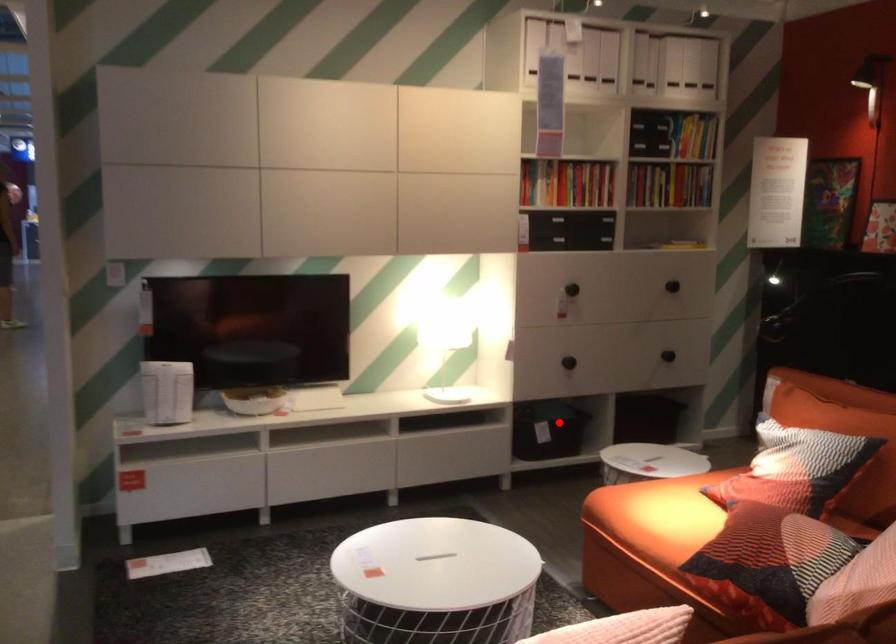
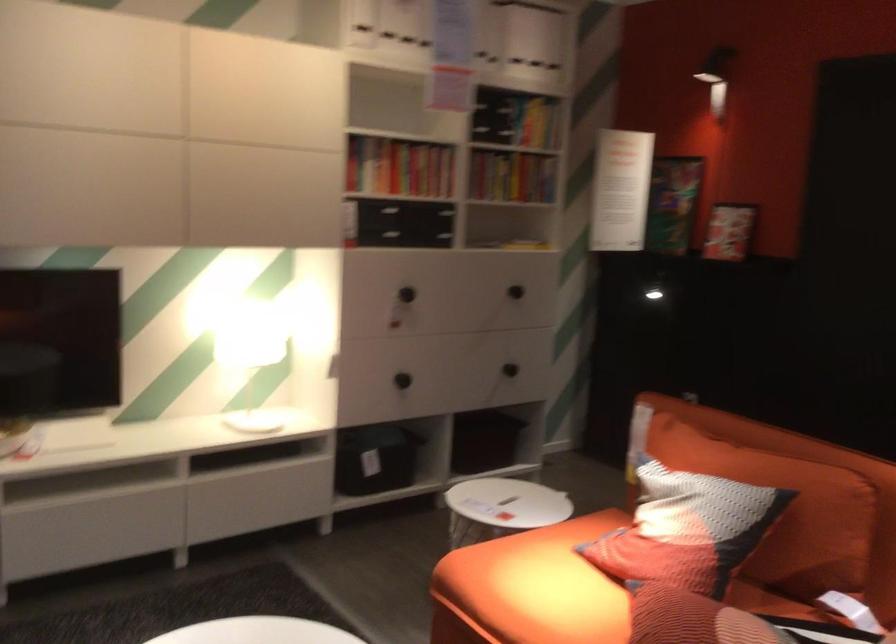
Find the pixel in the second image that matches the highlighted location in the first image.

(375, 459)